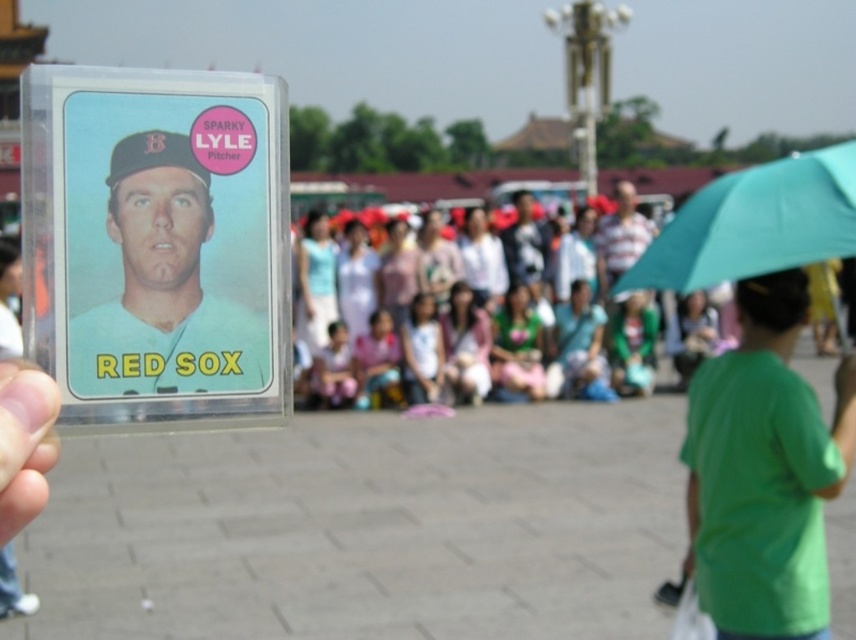
Is green matte shirt at lower right taller than matte plastic baseball card at center?

Indeed, green matte shirt at lower right has a greater height compared to matte plastic baseball card at center.

Can you confirm if green matte shirt at lower right is positioned to the right of matte plastic baseball card at center?

Correct, you'll find green matte shirt at lower right to the right of matte plastic baseball card at center.

What do you see at coordinates (764, 472) in the screenshot? I see `green matte shirt at lower right` at bounding box center [764, 472].

The image size is (856, 640). Identify the location of green matte shirt at lower right. (764, 472).

Which is in front, point (153, 230) or point (304, 188)?

Positioned in front is point (153, 230).

Can you confirm if matte plastic baseball card at center is wider than matte plastic crowd at center?

Incorrect, matte plastic baseball card at center's width does not surpass matte plastic crowd at center's.

Where is `matte plastic baseball card at center`? The image size is (856, 640). matte plastic baseball card at center is located at coordinates (163, 288).

Identify the location of matte plastic baseball card at center. (163, 288).

Who is positioned more to the left, green matte shirt at lower right or clear plastic card at lower left?

clear plastic card at lower left is more to the left.

Locate an element on the screen. green matte shirt at lower right is located at coordinates (764, 472).